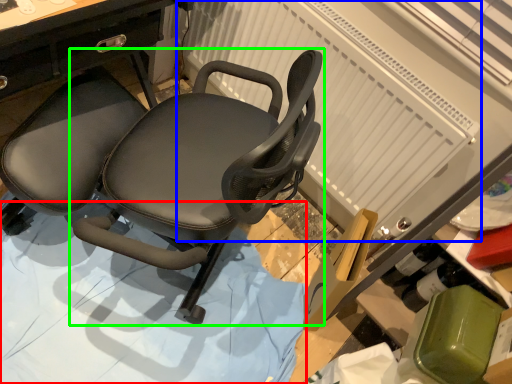
Question: Estimate the real-world distances between objects in this image. Which object is farther from surface (highlighted by a red box), radiator (highlighted by a blue box) or chair (highlighted by a green box)?

Choices:
 (A) radiator
 (B) chair

Answer: (A)